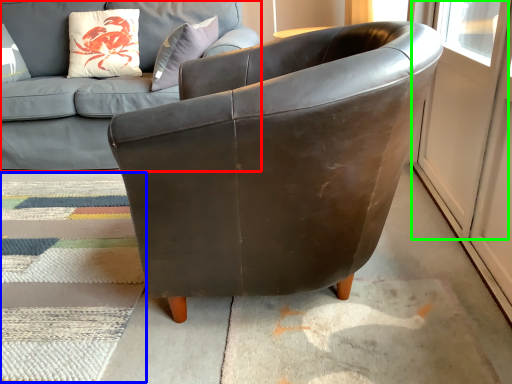
Question: Which is farther away from studio couch (highlighted by a red box)? mat (highlighted by a blue box) or screen door (highlighted by a green box)?

Choices:
 (A) mat
 (B) screen door

Answer: (B)